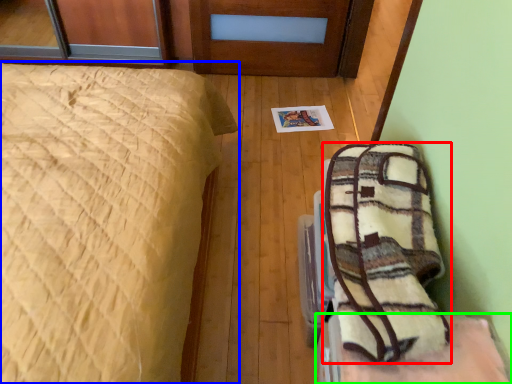
Question: Based on their relative distances, which object is nearer to blanket (highlighted by a red box)? Choose from bed (highlighted by a blue box) and furniture (highlighted by a green box).

Choices:
 (A) bed
 (B) furniture

Answer: (B)